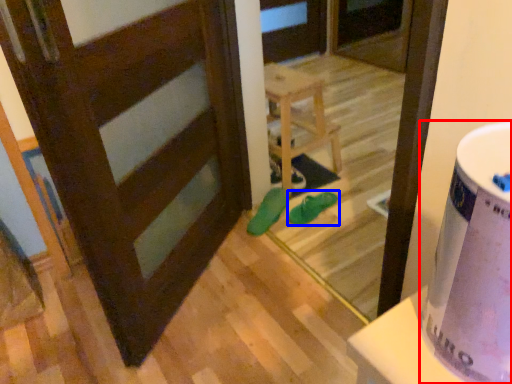
Question: Which of the following is the farthest to the observer, potty (highlighted by a red box) or footwear (highlighted by a blue box)?

Choices:
 (A) potty
 (B) footwear

Answer: (B)